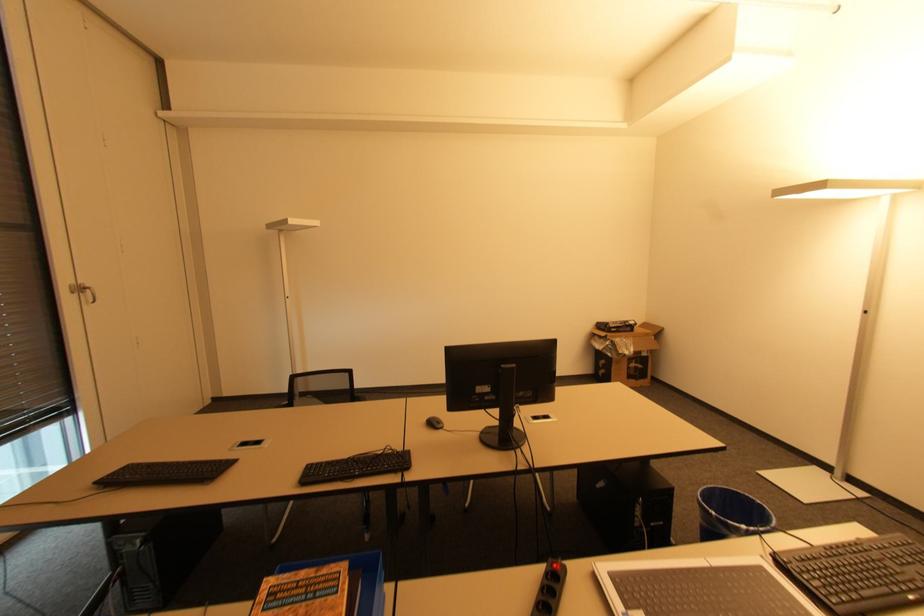
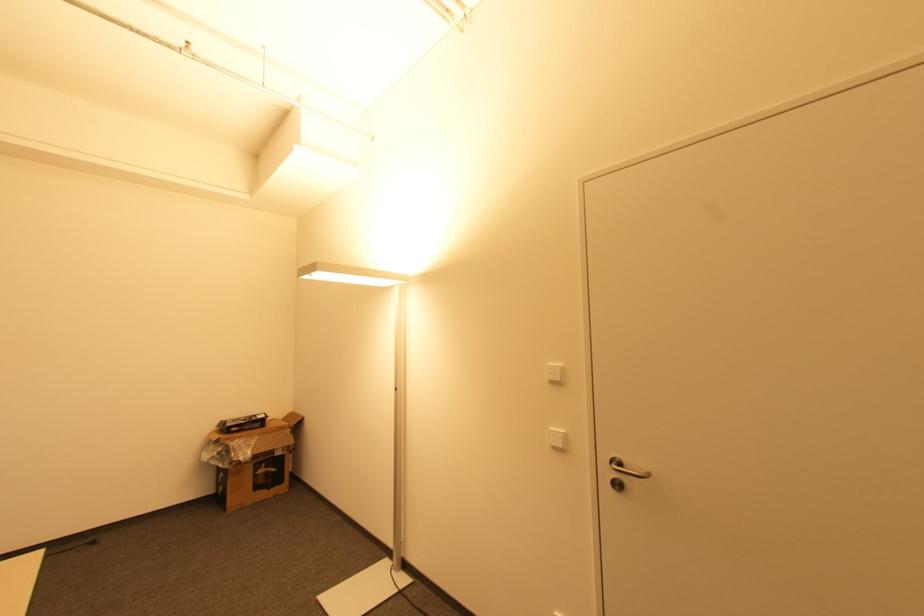
The point at (x=638, y=368) is marked in the first image. Where is the corresponding point in the second image?

(268, 472)